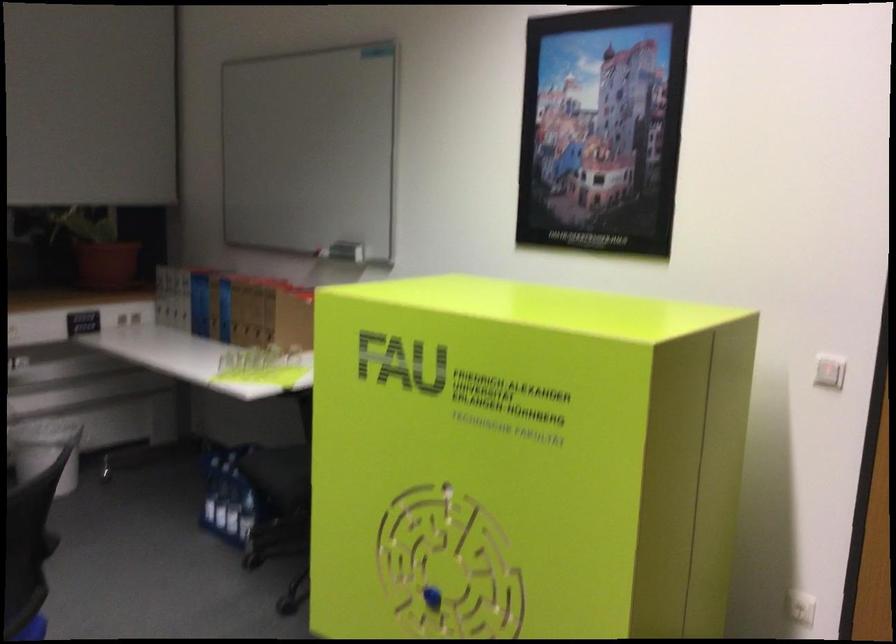
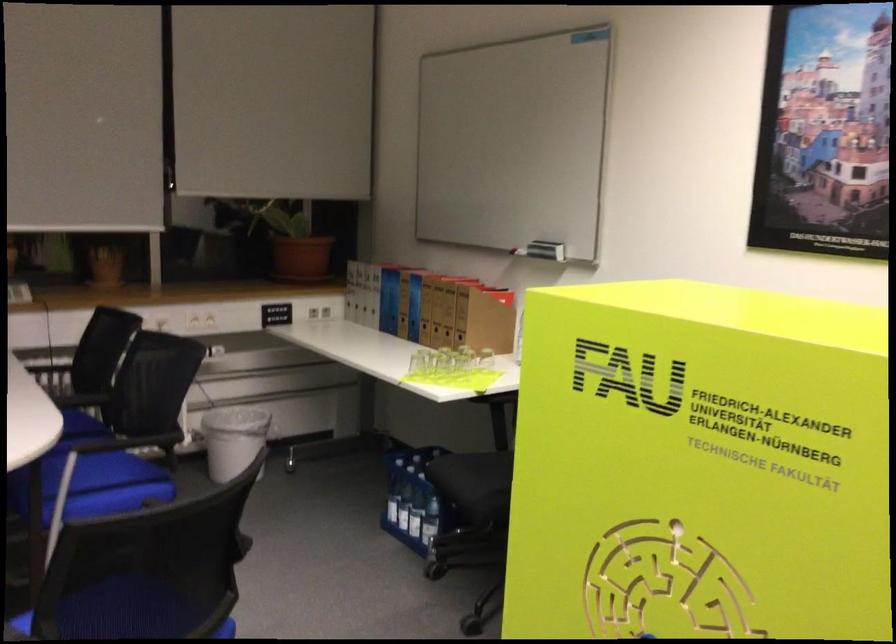
In the second image, find the point that corresponds to point 195,325 in the first image.

(382, 321)